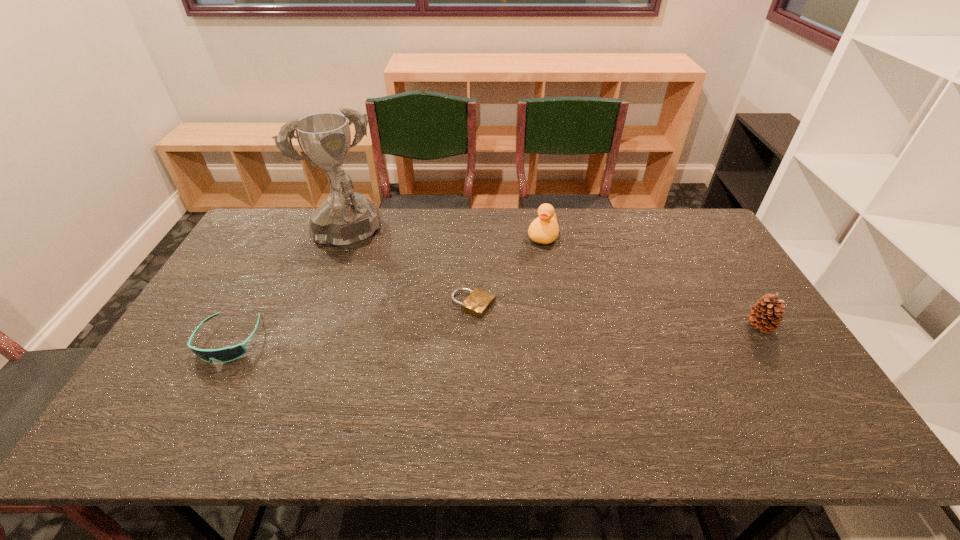
In order to click on free space between the shortest object and the pinecone in this screenshot , I will do `click(617, 315)`.

You are a GUI agent. You are given a task and a screenshot of the screen. Output one action in this format:
    pyautogui.click(x=<x>, y=<y>)
    Task: Click on the free space between the third object from right to left and the second shortest object
    The image size is (960, 540).
    Given the screenshot: What is the action you would take?
    pyautogui.click(x=351, y=322)

I want to click on free space between the fourth object from left to right and the second shortest object, so click(x=386, y=288).

Locate an element on the screen. vacant space in between the second object from left to right and the rightmost object is located at coordinates (552, 282).

Locate an element on the screen. The width and height of the screenshot is (960, 540). vacant space that is in between the fourth object from left to right and the rightmost object is located at coordinates (652, 281).

Find the location of a particular element. This screenshot has height=540, width=960. free space between the third object from right to left and the pinecone is located at coordinates (617, 315).

Locate an element on the screen. The height and width of the screenshot is (540, 960). free space between the second shortest object and the shortest object is located at coordinates (351, 322).

Identify which object is the nearest to the duck. Please provide its 2D coordinates. Your answer should be formatted as a tuple, i.e. [(x, y)], where the tuple contains the x and y coordinates of a point satisfying the conditions above.

[(478, 302)]

You are a GUI agent. You are given a task and a screenshot of the screen. Output one action in this format:
    pyautogui.click(x=<x>, y=<y>)
    Task: Click on the closest object to the rightmost object
    The width and height of the screenshot is (960, 540).
    Given the screenshot: What is the action you would take?
    pyautogui.click(x=544, y=229)

This screenshot has height=540, width=960. I want to click on free point that satisfies the following two spatial constraints: 1. on the front side of the tallest object; 2. on the left side of the pinecone, so click(311, 326).